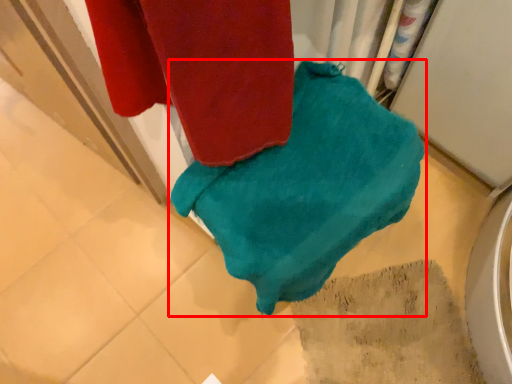
Question: Where is towel (annotated by the red box) located in relation to tile in the image?

Choices:
 (A) right
 (B) left

Answer: (B)